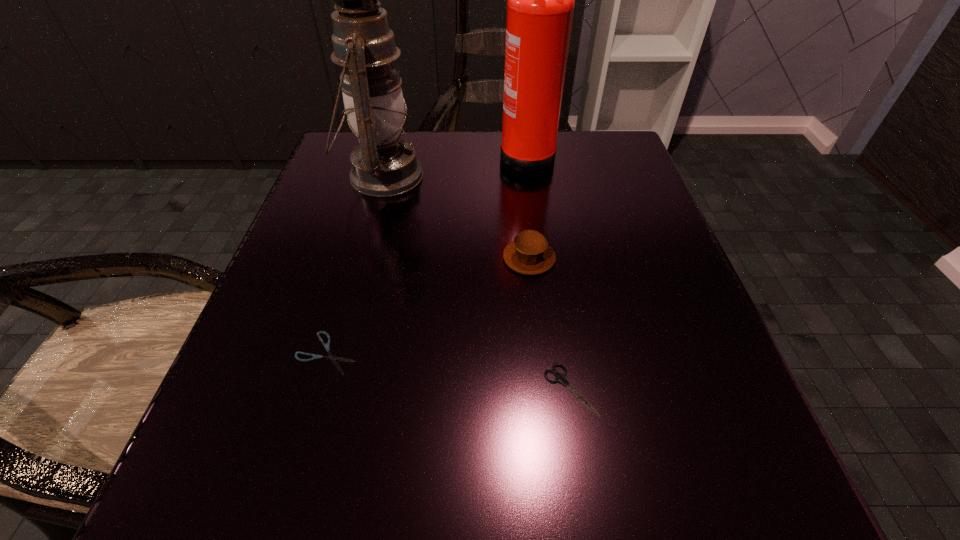
The image size is (960, 540). Identify the location of fire extinguisher. (540, 0).

Locate an element on the screen. The width and height of the screenshot is (960, 540). oil lamp is located at coordinates (383, 165).

Image resolution: width=960 pixels, height=540 pixels. Find the location of `the third tallest object`. the third tallest object is located at coordinates (529, 253).

Locate an element on the screen. The image size is (960, 540). muffin is located at coordinates (529, 253).

Where is `the second shortest object`? This screenshot has width=960, height=540. the second shortest object is located at coordinates (561, 378).

Where is `the taller shears`? The height and width of the screenshot is (540, 960). the taller shears is located at coordinates (561, 378).

The width and height of the screenshot is (960, 540). I want to click on the left shears, so click(327, 346).

What are the coordinates of `the shortest object` in the screenshot? It's located at (327, 346).

Identify the location of free region located 0.350m at the nozzle of the fire extinguisher. This screenshot has height=540, width=960. (338, 156).

Identify the location of vacant space located 0.320m at the nozzle of the fire extinguisher. (351, 156).